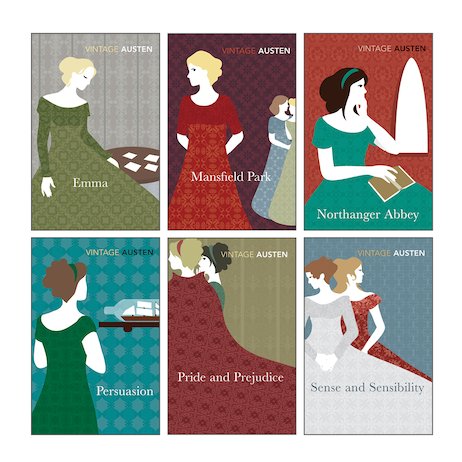
Locate an element on the screen. table is located at coordinates (137, 158).